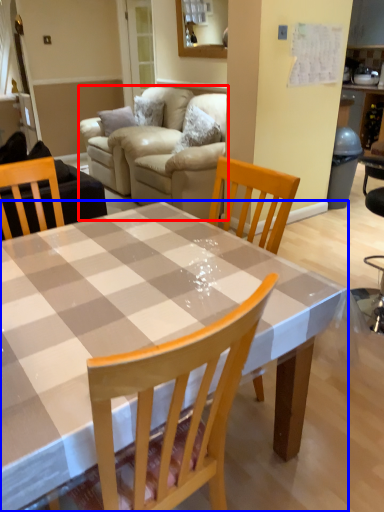
Question: Which point is further to the camera, studio couch (highlighted by a red box) or kitchen & dining room table (highlighted by a blue box)?

Choices:
 (A) studio couch
 (B) kitchen & dining room table

Answer: (A)